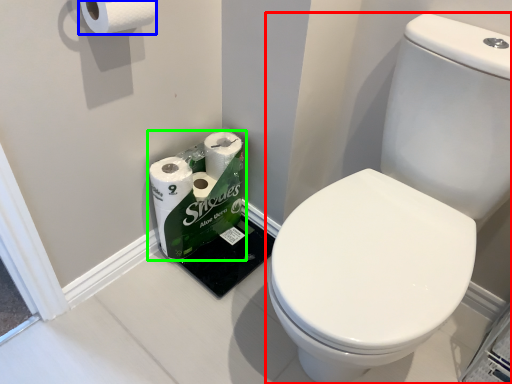
Question: Estimate the real-world distances between objects in this image. Which object is closer to toilet (highlighted by a red box), toilet paper (highlighted by a blue box) or toilet paper (highlighted by a green box)?

Choices:
 (A) toilet paper
 (B) toilet paper

Answer: (B)